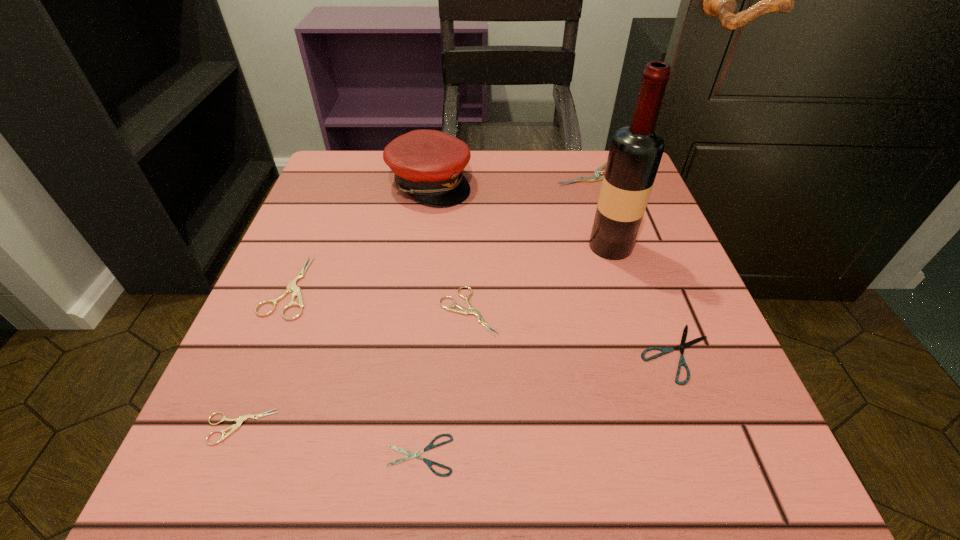
Find the location of a particular element. This screenshot has width=960, height=540. wine bottle is located at coordinates (635, 153).

The image size is (960, 540). Identify the location of red cap. point(428,164).

This screenshot has width=960, height=540. In order to click on the seventh shortest object in this screenshot , I will do `click(428, 164)`.

Locate an element on the screen. The image size is (960, 540). the third tallest object is located at coordinates (596, 176).

Find the location of a particular element. the tallest shears is located at coordinates (596, 176).

You are a GUI agent. You are given a task and a screenshot of the screen. Output one action in this format:
    pyautogui.click(x=<x>, y=<y>)
    Task: Click on the second biggest beige shears
    Image resolution: width=960 pixels, height=540 pixels.
    Given the screenshot: What is the action you would take?
    pyautogui.click(x=292, y=287)

Where is `the second tallest shears`? The image size is (960, 540). the second tallest shears is located at coordinates [x=292, y=287].

I want to click on the second smallest beige shears, so click(462, 310).

Where is `the fourth shortest shears`? The image size is (960, 540). the fourth shortest shears is located at coordinates (462, 310).

You are a GUI agent. You are given a task and a screenshot of the screen. Output one action in this format:
    pyautogui.click(x=<x>, y=<y>)
    Task: Click on the smallest beige shears
    Image resolution: width=960 pixels, height=540 pixels.
    Given the screenshot: What is the action you would take?
    pyautogui.click(x=239, y=420)